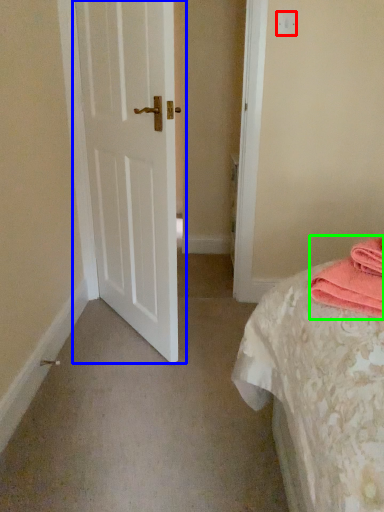
Question: Which object is positioned farthest from light switch (highlighted by a red box)? Select from door (highlighted by a blue box) and material (highlighted by a green box).

Choices:
 (A) door
 (B) material

Answer: (B)